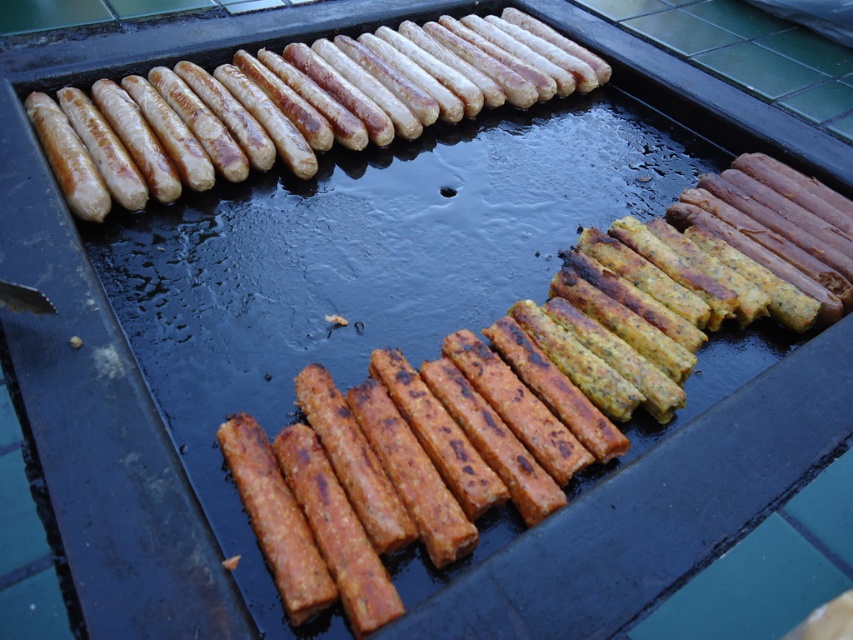
Question: Does golden-brown glazed sausages at upper left appear on the right side of brown crumbly sausage at center?

Choices:
 (A) yes
 (B) no

Answer: (B)

Question: Which object is closer to the camera taking this photo?

Choices:
 (A) golden-brown glazed sausages at upper left
 (B) brown crumbly sausage at center

Answer: (B)

Question: Among these objects, which one is nearest to the camera?

Choices:
 (A) brown crumbly sausage at center
 (B) golden-brown glazed sausages at upper left

Answer: (A)

Question: Is golden-brown glazed sausages at upper left positioned in front of brown crumbly sausage at center?

Choices:
 (A) yes
 (B) no

Answer: (B)

Question: In this image, where is golden-brown glazed sausages at upper left located relative to brown crumbly sausage at center?

Choices:
 (A) below
 (B) above

Answer: (B)